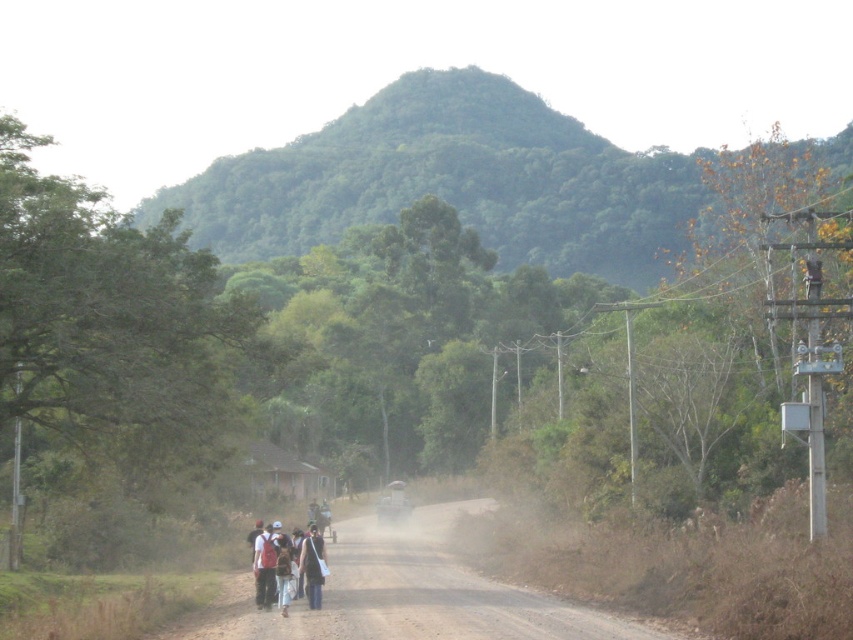
Does white cotton shirt at center appear on the left side of dark blue fabric jacket at center?

Yes, white cotton shirt at center is to the left of dark blue fabric jacket at center.

I want to click on white cotton shirt at center, so click(280, 564).

In the scene shown: Who is more distant from viewer, (264,540) or (305,536)?

The point (305,536) is behind.

Find the location of a particular element. Image resolution: width=853 pixels, height=640 pixels. white cotton shirt at center is located at coordinates (280, 564).

Does dark blue fabric jacket at center lie behind metallic silver motorcycle at center?

No, dark blue fabric jacket at center is closer to the viewer.

Who is lower down, dark blue fabric jacket at center or metallic silver motorcycle at center?

metallic silver motorcycle at center is below.

Does point (312, 529) lie behind point (405, 499)?

No, (312, 529) is in front of (405, 499).

Where is `dark blue fabric jacket at center`? The height and width of the screenshot is (640, 853). dark blue fabric jacket at center is located at coordinates point(312,566).

Does brown dusty road at center appear on the right side of white cotton shirt at center?

Indeed, brown dusty road at center is positioned on the right side of white cotton shirt at center.

Consider the image. Measure the distance between brown dusty road at center and camera.

brown dusty road at center and camera are 17.32 meters apart.

Which is in front, point (338, 548) or point (277, 554)?

Point (277, 554) is more forward.

This screenshot has width=853, height=640. What are the coordinates of `brown dusty road at center` in the screenshot? It's located at (408, 595).